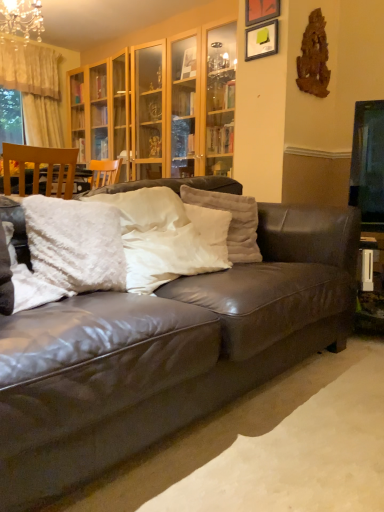
Question: Based on their positions, is white fluffy pillow at center, which ranks as the third pillow in left-to-right order, located to the left or right of white fluffy pillow at center, the 4th pillow from the right?

Choices:
 (A) right
 (B) left

Answer: (A)

Question: In terms of size, does white fluffy pillow at center, which ranks as the third pillow in left-to-right order, appear bigger or smaller than white fluffy pillow at center, the 1th pillow viewed from the left?

Choices:
 (A) small
 (B) big

Answer: (B)

Question: Which is farther from the brown leather couch at center?

Choices:
 (A) white fluffy pillow at center, the 2th pillow when ordered from left to right
 (B) crystal glass chandelier at upper left
 (C) matte black picture frame at upper center, which ranks as the second picture frame in top-to-bottom order
 (D) white fluffy pillow at center, arranged as the second pillow when viewed from the right
 (E) wooden chair at left

Answer: (B)

Question: Which object is positioned farthest from the matte black picture frame at upper center, which ranks as the second picture frame in top-to-bottom order?

Choices:
 (A) crystal glass chandelier at upper left
 (B) white fluffy pillow at center, which ranks as the third pillow in left-to-right order
 (C) white fluffy pillow at center, the 1th pillow viewed from the left
 (D) wooden chair at left
 (E) white fluffy pillow at center, the third pillow positioned from the right

Answer: (A)